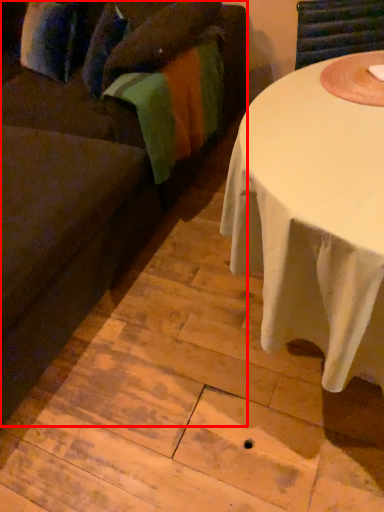
Question: Where is studio couch (annotated by the red box) located in relation to blanket in the image?

Choices:
 (A) left
 (B) right

Answer: (A)